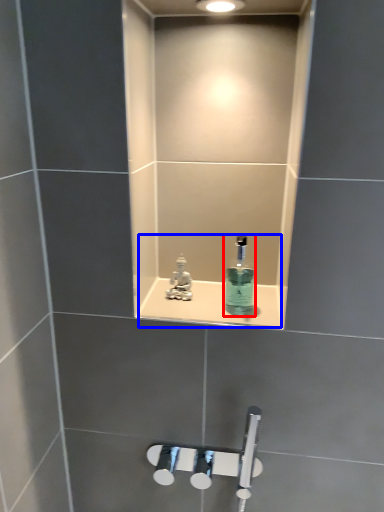
Question: Which object appears closest to the camera in this image, mouthwash (highlighted by a red box) or sink (highlighted by a blue box)?

Choices:
 (A) mouthwash
 (B) sink

Answer: (A)